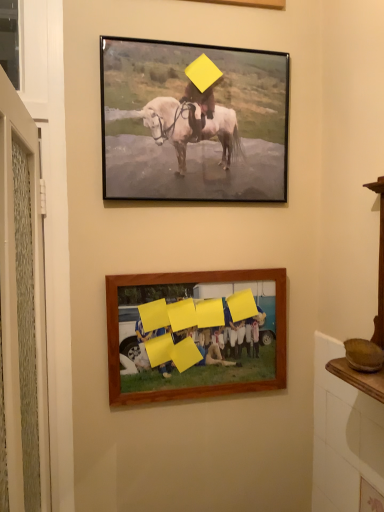
Question: Is wooden frame at lower center, positioned as the first picture frame in bottom-to-top order, to the left or to the right of matte black frame at upper center, marked as the 1th picture frame in a top-to-bottom arrangement, in the image?

Choices:
 (A) right
 (B) left

Answer: (A)

Question: Is point (210, 392) positioned closer to the camera than point (145, 190)?

Choices:
 (A) closer
 (B) farther

Answer: (B)

Question: Is wooden frame at lower center, positioned as the first picture frame in bottom-to-top order, spatially inside matte black frame at upper center, the 2th picture frame from the bottom, or outside of it?

Choices:
 (A) inside
 (B) outside

Answer: (B)

Question: Considering their positions, is matte black frame at upper center, the 2th picture frame from the bottom, located in front of or behind wooden frame at lower center, positioned as the first picture frame in bottom-to-top order?

Choices:
 (A) behind
 (B) front

Answer: (B)

Question: Is point (125, 181) closer or farther from the camera than point (190, 367)?

Choices:
 (A) farther
 (B) closer

Answer: (B)

Question: In terms of height, does matte black frame at upper center, the 2th picture frame from the bottom, look taller or shorter compared to wooden frame at lower center, positioned as the second picture frame in top-to-bottom order?

Choices:
 (A) short
 (B) tall

Answer: (B)

Question: Based on their sizes in the image, would you say matte black frame at upper center, the 2th picture frame from the bottom, is bigger or smaller than wooden frame at lower center, positioned as the first picture frame in bottom-to-top order?

Choices:
 (A) big
 (B) small

Answer: (A)